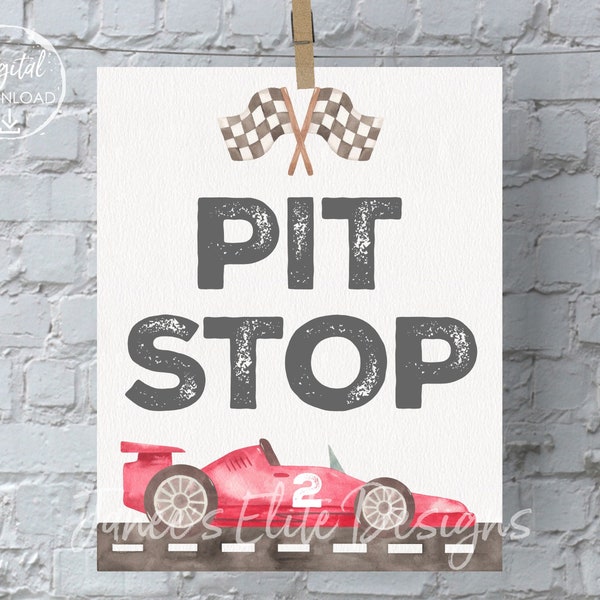
The height and width of the screenshot is (600, 600). I want to click on door handle, so click(x=282, y=475).